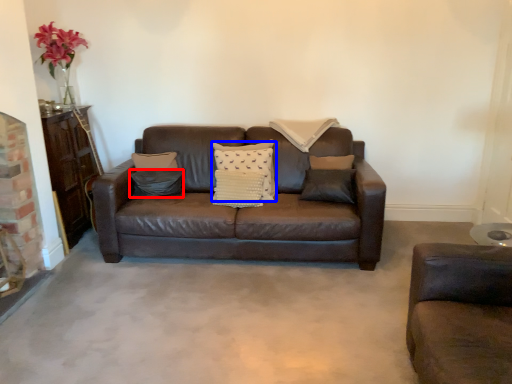
Question: Which object appears farthest to the camera in this image, pillow (highlighted by a red box) or pillow (highlighted by a blue box)?

Choices:
 (A) pillow
 (B) pillow

Answer: (A)